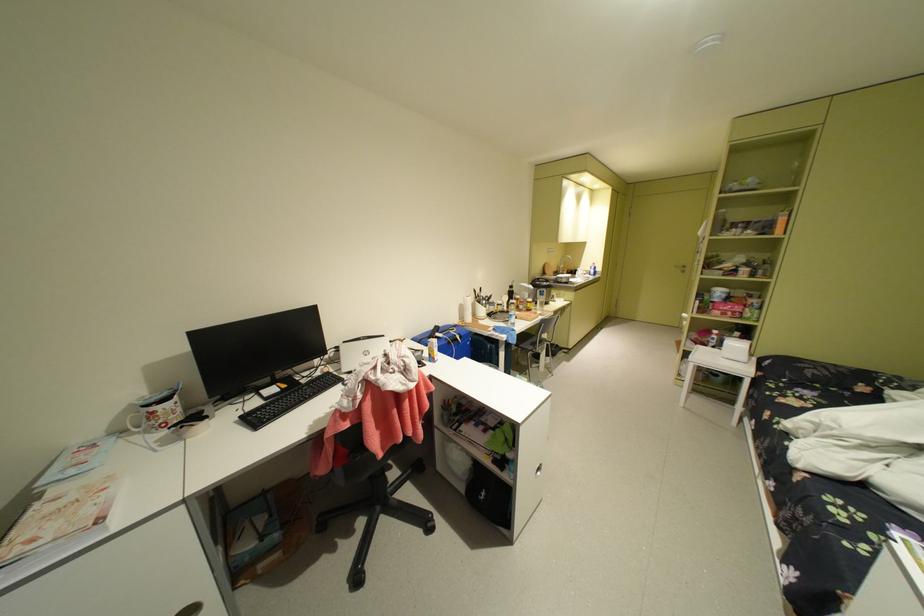
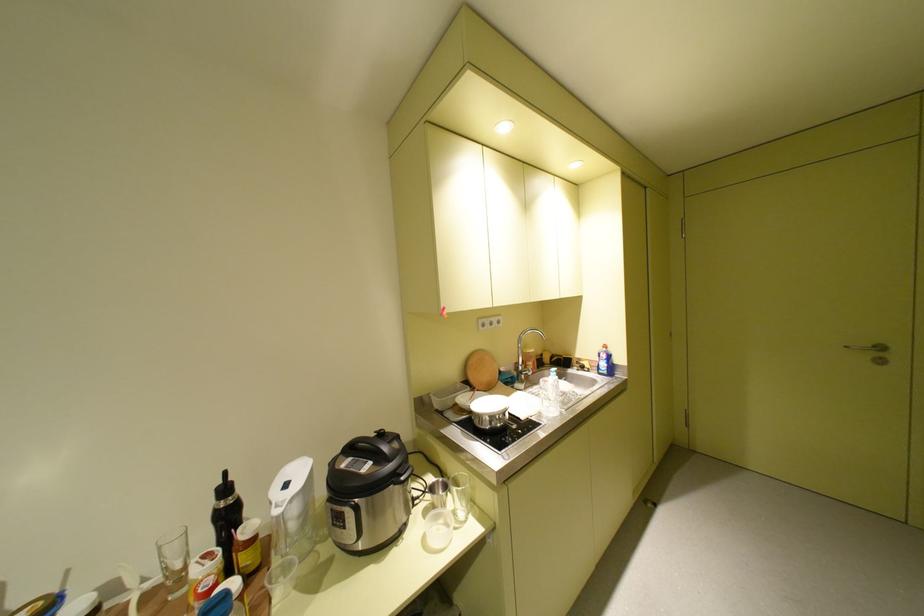
Which direction would the cameraman need to move to produce the second image?

The cameraman moved toward right, forward.